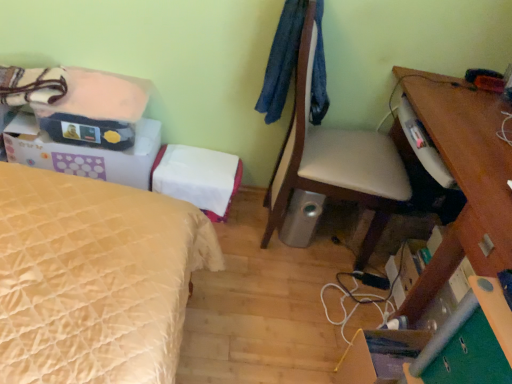
Find the location of a particular element. The image size is (512, 384). blank space situated above matte black bag at upper left (from a real-world perspective) is located at coordinates (x=97, y=82).